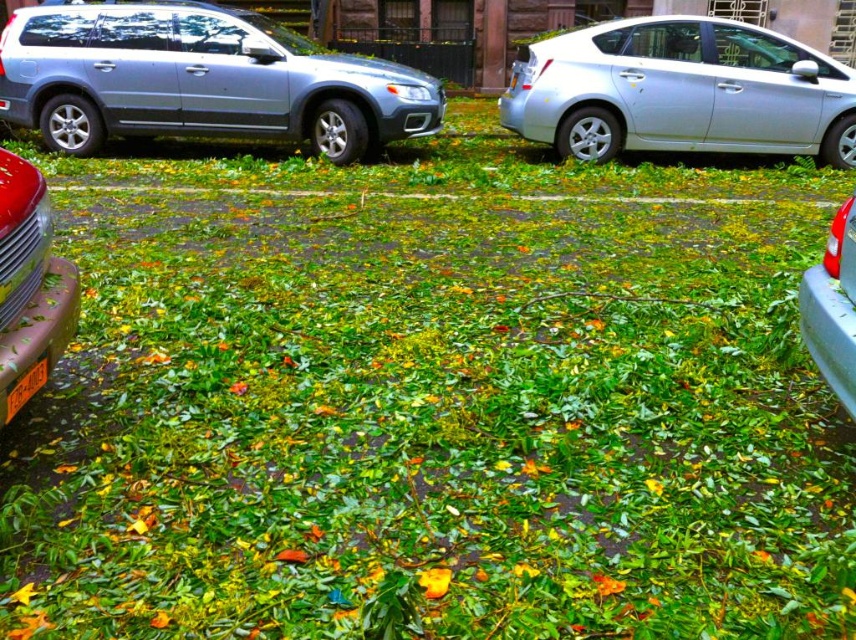
Which of these two, metallic red car at left or orange plastic license plate at lower left, stands taller?

metallic red car at left

Between point (34, 196) and point (39, 362), which one is positioned behind?

Positioned behind is point (34, 196).

Locate an element on the screen. The height and width of the screenshot is (640, 856). metallic red car at left is located at coordinates (28, 285).

The height and width of the screenshot is (640, 856). What do you see at coordinates (681, 90) in the screenshot?
I see `satin silver sedan at right` at bounding box center [681, 90].

Can you confirm if satin silver sedan at right is positioned above metallic red car at left?

Yes.

Image resolution: width=856 pixels, height=640 pixels. What are the coordinates of `satin silver sedan at right` in the screenshot? It's located at pos(681,90).

Is satin silver suv at left taller than metallic red car at left?

Indeed, satin silver suv at left has a greater height compared to metallic red car at left.

Who is positioned more to the right, satin silver suv at left or metallic red car at left?

Positioned to the right is metallic red car at left.

Does point (0, 106) come behind point (31, 358)?

Yes.

At what (x,y) coordinates should I click in order to perform the action: click on satin silver suv at left. Please return your answer as a coordinate pair (x, y). Looking at the image, I should click on (200, 80).